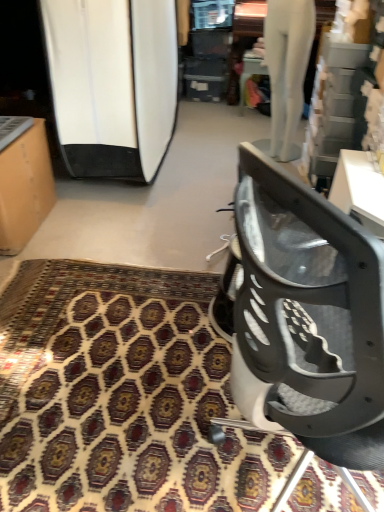
Question: From a real-world perspective, is white glossy surfboard at left physically located above or below patterned carpet at center?

Choices:
 (A) below
 (B) above

Answer: (B)

Question: Choose the correct answer: Is white glossy surfboard at left inside patterned carpet at center or outside it?

Choices:
 (A) inside
 (B) outside

Answer: (B)

Question: Considering the real-world distances, which object is farthest from the white glossy surfboard at left?

Choices:
 (A) patterned carpet at center
 (B) matte cardboard box at left
 (C) metallic gray chair at lower right

Answer: (C)

Question: Which of these objects is positioned closest to the patterned carpet at center?

Choices:
 (A) metallic gray chair at lower right
 (B) matte cardboard box at left
 (C) white glossy surfboard at left

Answer: (A)